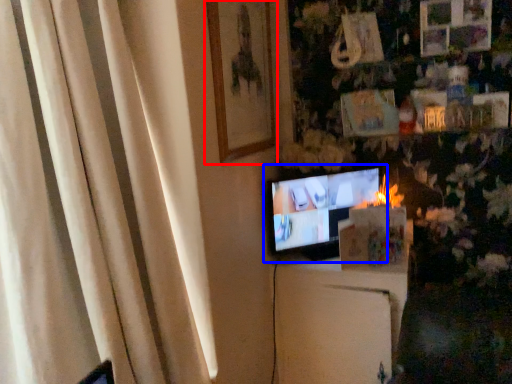
Question: Which point is closer to the camera, picture frame (highlighted by a red box) or television (highlighted by a blue box)?

Choices:
 (A) picture frame
 (B) television

Answer: (A)